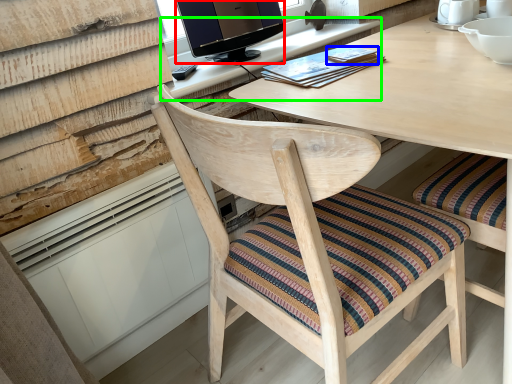
Question: Considering the real-world distances, which object is farthest from television (highlighted by a red box)? book (highlighted by a blue box) or computer desk (highlighted by a green box)?

Choices:
 (A) book
 (B) computer desk

Answer: (A)